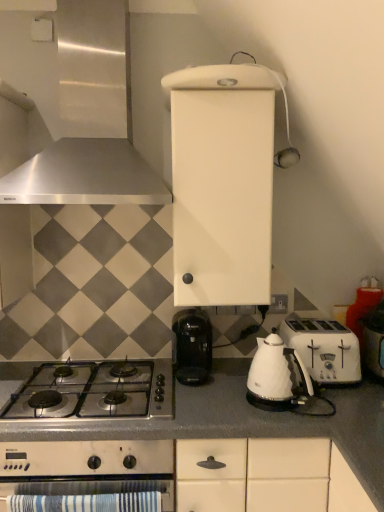
Question: From a real-world perspective, is stainless steel gas stove at lower left physically located above or below white plastic toaster at right?

Choices:
 (A) above
 (B) below

Answer: (B)

Question: From their relative heights in the image, would you say stainless steel gas stove at lower left is taller or shorter than white plastic toaster at right?

Choices:
 (A) short
 (B) tall

Answer: (A)

Question: Which of these objects is positioned farthest from the gray matte countertop at lower center?

Choices:
 (A) white plastic toaster at right
 (B) white plastic electric outlet at center-right
 (C) satin silver range hood at upper left
 (D) white plastic toaster at right
 (E) stainless steel gas stove at lower left

Answer: (C)

Question: Estimate the real-world distances between objects in this image. Which object is closer to the white glossy kettle at lower center?

Choices:
 (A) white plastic electric outlet at center-right
 (B) stainless steel gas stove at lower left
 (C) gray matte countertop at lower center
 (D) white plastic toaster at right
 (E) white plastic toaster at right

Answer: (E)